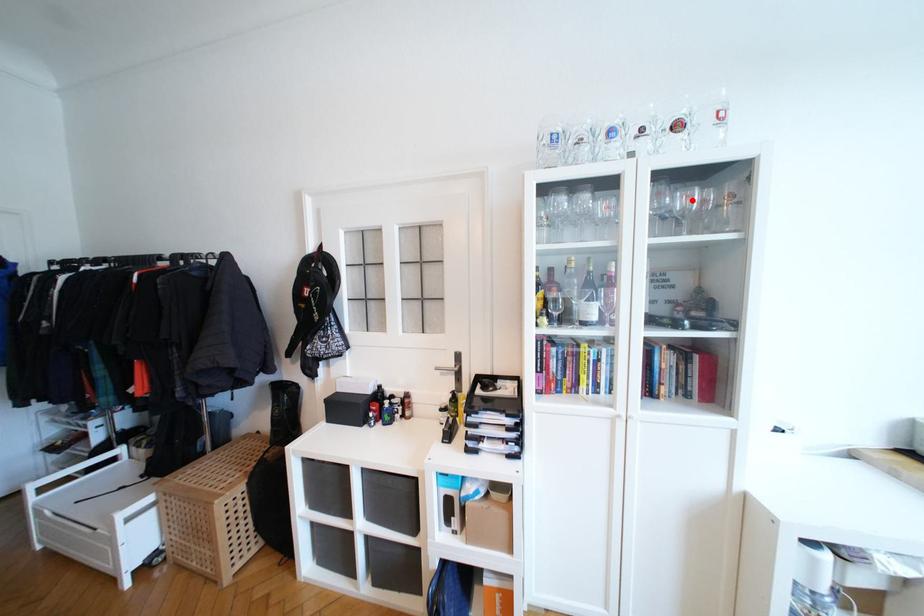
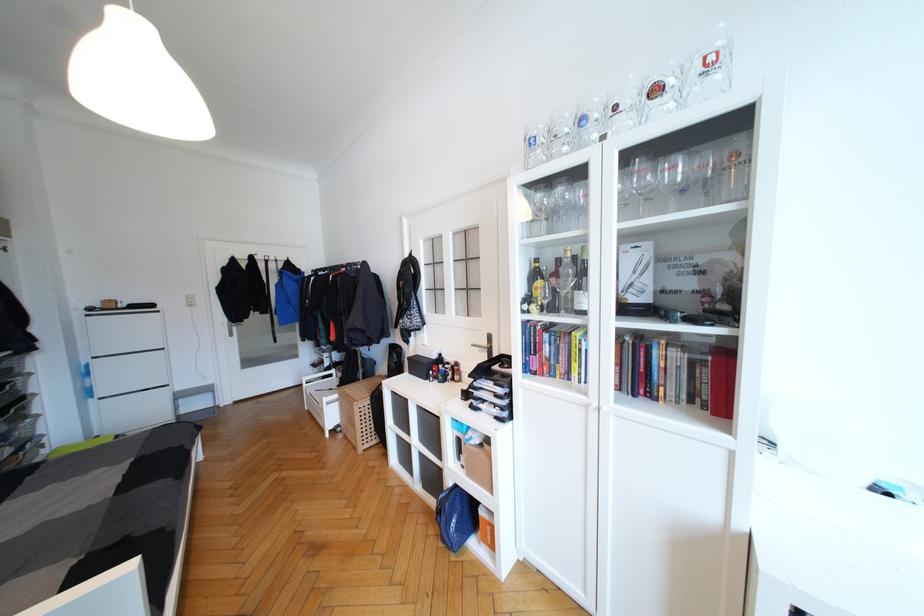
In the second image, find the point that corresponds to the highlighted location in the first image.

(679, 171)